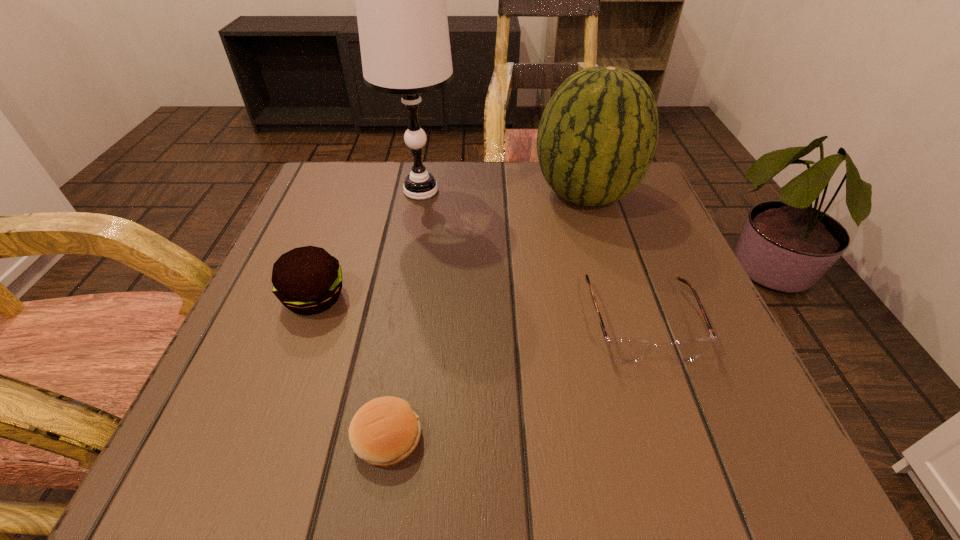
At what (x,y) coordinates should I click in order to perform the action: click on free space located 0.120m on the front-facing side of the spectacles. Please return your answer as a coordinate pair (x, y). This screenshot has height=540, width=960. Looking at the image, I should click on (682, 442).

I want to click on vacant area situated on the right of the shortest object, so click(543, 437).

Locate an element on the screen. The image size is (960, 540). table lamp at the far edge is located at coordinates (400, 0).

The height and width of the screenshot is (540, 960). I want to click on watermelon at the far edge, so click(x=597, y=137).

Identify the location of object at the near edge. This screenshot has height=540, width=960. (384, 431).

Locate an element on the screen. Image resolution: width=960 pixels, height=540 pixels. object at the left edge is located at coordinates (307, 280).

The width and height of the screenshot is (960, 540). I want to click on watermelon that is at the right edge, so click(x=597, y=137).

Locate an element on the screen. Image resolution: width=960 pixels, height=540 pixels. spectacles that is at the right edge is located at coordinates (625, 349).

Locate an element on the screen. The width and height of the screenshot is (960, 540). object positioned at the far right corner is located at coordinates (597, 137).

Find the location of a particular element. The image size is (960, 540). free space at the far edge of the desktop is located at coordinates (491, 188).